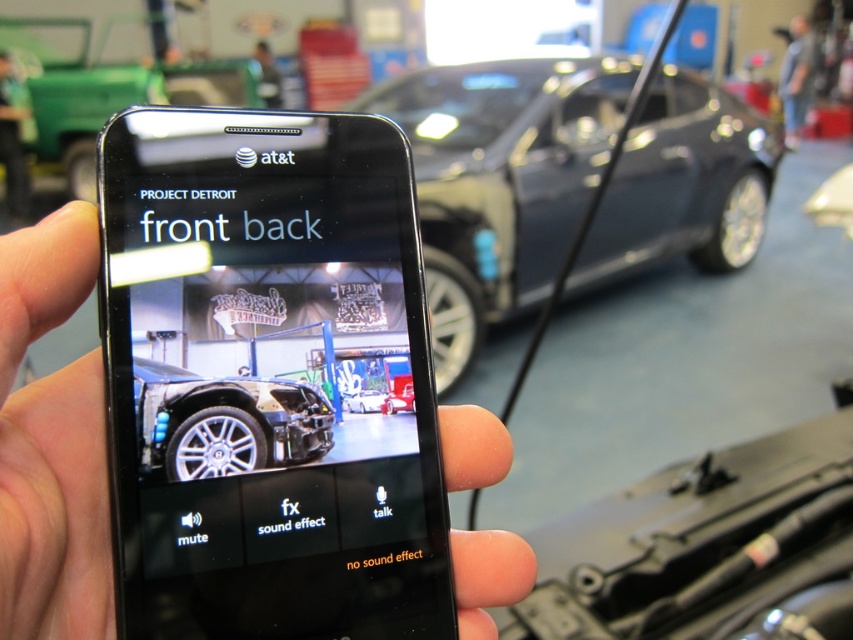
You are looking at the phone screen and see two points marked on it. The first point is at coordinate point[630,72] and the second is at point[22,108]. From your perspective, which point is closer to you?

Point[630,72] is in front of point[22,108], so it is closer to you.

You are a person looking at the phone screen in the image. There is a point at coordinates point (798, 77). Can you tell me what object this point is on?

The point (798, 77) is on the gray fabric shirt at upper right.

Based on the scene description, where is the glossy metallic car at center located in the image?

The glossy metallic car at center is located at point (500, 180).